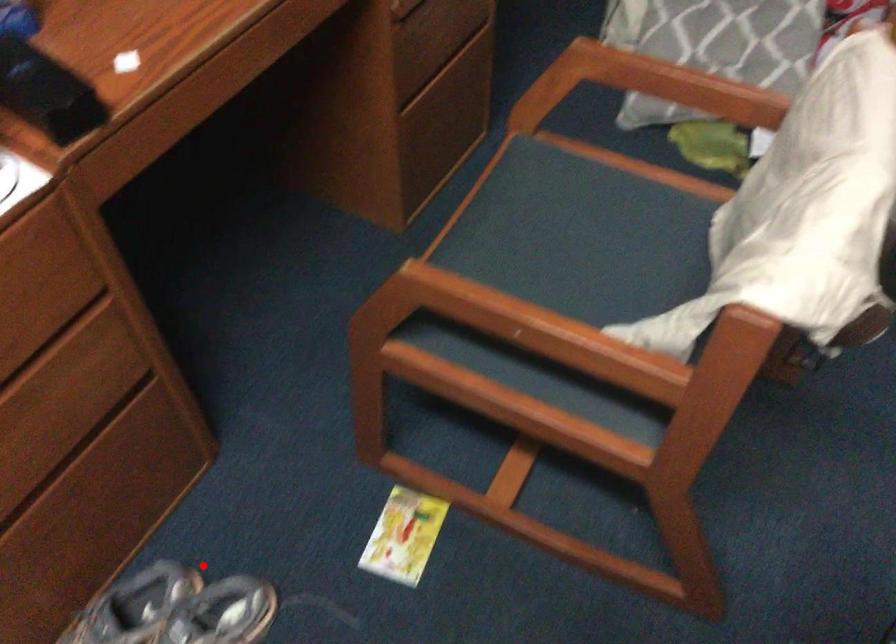
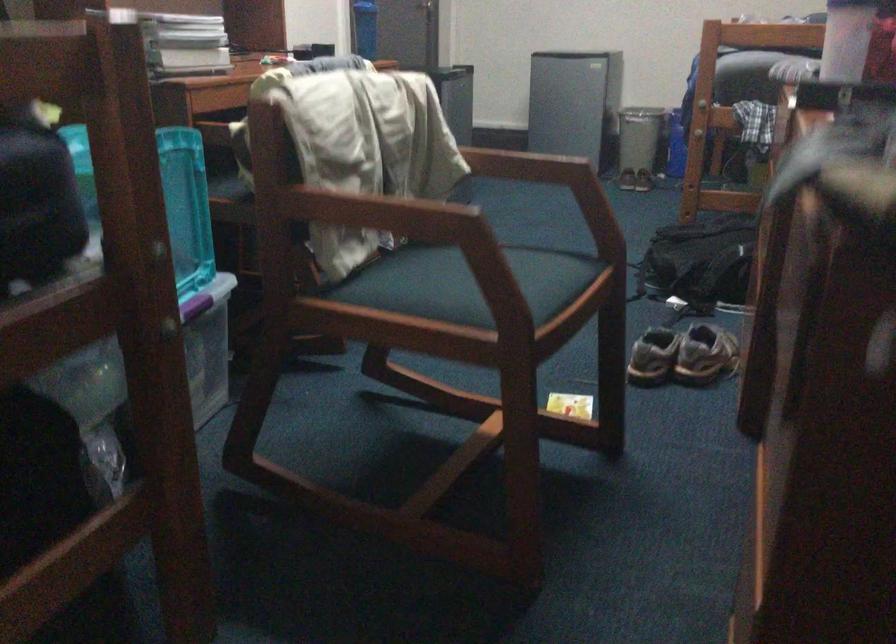
Question: I am providing you with two images of the same scene from different viewpoints. Image1 has a red point marked. In image2, the corresponding 3D location appears at what relative position? Reply with the corresponding letter.

Choices:
 (A) Closer
 (B) Farther

Answer: (B)